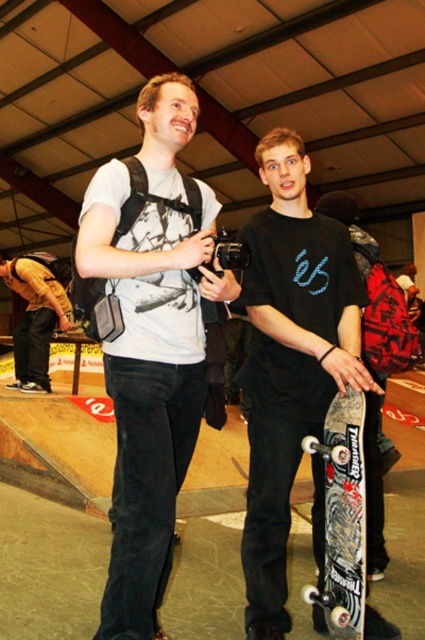
Between point (357, 440) and point (11, 385), which one is positioned in front?

Point (357, 440) is more forward.

Is point (334, 488) closer to camera compared to point (45, 280)?

Yes, point (334, 488) is in front of point (45, 280).

Locate an element on the screen. black textured skateboard at lower right is located at coordinates (342, 516).

Consider the image. Who is taller, black matte skateboard at center or yellow casual jacket at left?

black matte skateboard at center is taller.

Is black matte skateboard at center to the left of yellow casual jacket at left from the viewer's perspective?

Incorrect, black matte skateboard at center is not on the left side of yellow casual jacket at left.

The image size is (425, 640). Describe the element at coordinates (291, 358) in the screenshot. I see `black matte skateboard at center` at that location.

At what (x,y) coordinates should I click in order to perform the action: click on black matte skateboard at center. Please return your answer as a coordinate pair (x, y). The image size is (425, 640). Looking at the image, I should click on (291, 358).

Can you confirm if matte black t-shirt at center is positioned below black matte skateboard at center?

Incorrect, matte black t-shirt at center is not positioned below black matte skateboard at center.

Is matte black t-shirt at center bigger than black matte skateboard at center?

Yes, matte black t-shirt at center is bigger than black matte skateboard at center.

This screenshot has height=640, width=425. Identify the location of matte black t-shirt at center. click(149, 381).

Locate an element on the screen. Image resolution: width=425 pixels, height=640 pixels. matte black t-shirt at center is located at coordinates (149, 381).